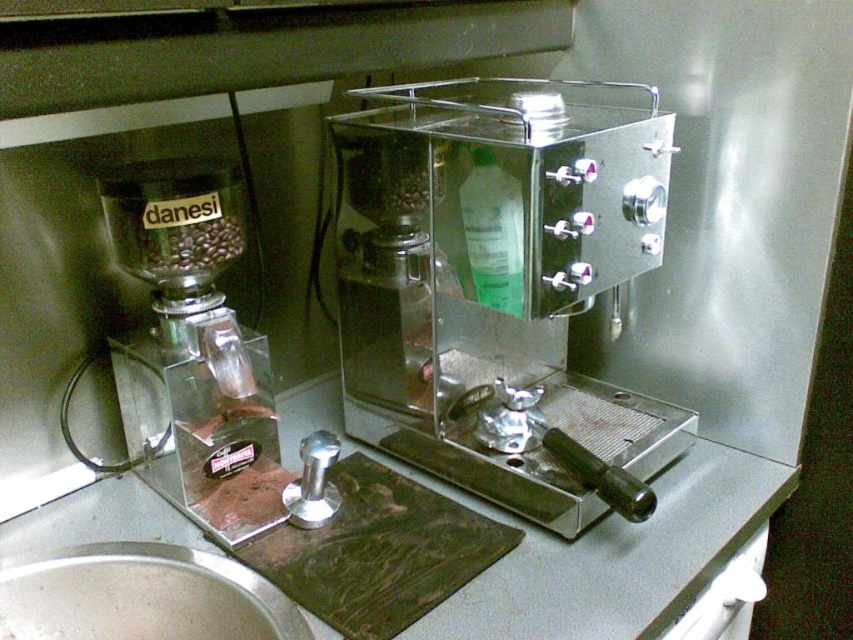
Question: Which point appears farthest from the camera in this image?

Choices:
 (A) (590, 300)
 (B) (84, 582)

Answer: (A)

Question: Which point is closer to the camera?

Choices:
 (A) (357, 120)
 (B) (257, 384)
 (C) (260, 596)

Answer: (C)

Question: Is polished stainless steel espresso machine at center smaller than matte black grinder at left?

Choices:
 (A) yes
 (B) no

Answer: (B)

Question: Is matte black grinder at left bigger than silver metallic sink at lower left?

Choices:
 (A) yes
 (B) no

Answer: (A)

Question: Does polished stainless steel espresso machine at center appear over silver metallic sink at lower left?

Choices:
 (A) no
 (B) yes

Answer: (B)

Question: Estimate the real-world distances between objects in this image. Which object is closer to the silver metallic sink at lower left?

Choices:
 (A) polished stainless steel espresso machine at center
 (B) matte black grinder at left

Answer: (B)